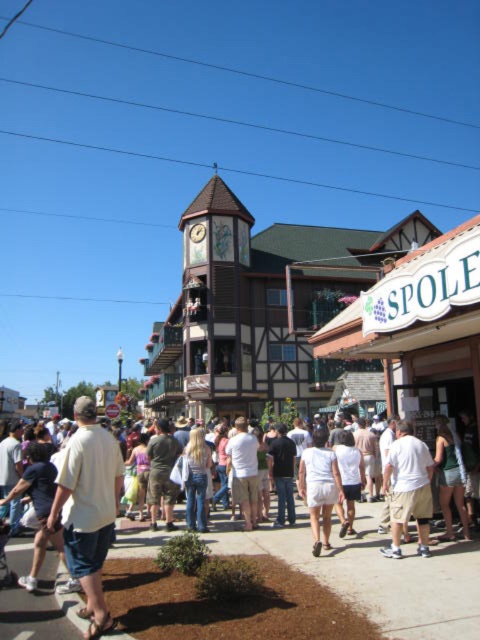
Question: Which of the following is the farthest from the observer?

Choices:
 (A) brown wooden clock tower at center
 (B) light beige shirt at center
 (C) light beige shorts at center

Answer: (A)

Question: Can you confirm if brown wooden clock tower at center is wider than light beige shirt at center?

Choices:
 (A) no
 (B) yes

Answer: (B)

Question: Estimate the real-world distances between objects in this image. Which object is closer to the wooden clock at center?

Choices:
 (A) light beige shirt at center
 (B) brown wooden clock tower at center
 (C) brown dirt at center
 (D) white cotton shorts at center

Answer: (B)

Question: Where is light beige shorts at center located in relation to wooden clock at center in the image?

Choices:
 (A) above
 (B) below

Answer: (B)

Question: Can you confirm if light beige shorts at center is positioned to the right of white cotton shorts at center?

Choices:
 (A) yes
 (B) no

Answer: (A)

Question: Which point is farther to the camera?

Choices:
 (A) (420, 524)
 (B) (78, 461)
 (C) (192, 237)
 (D) (139, 541)

Answer: (C)